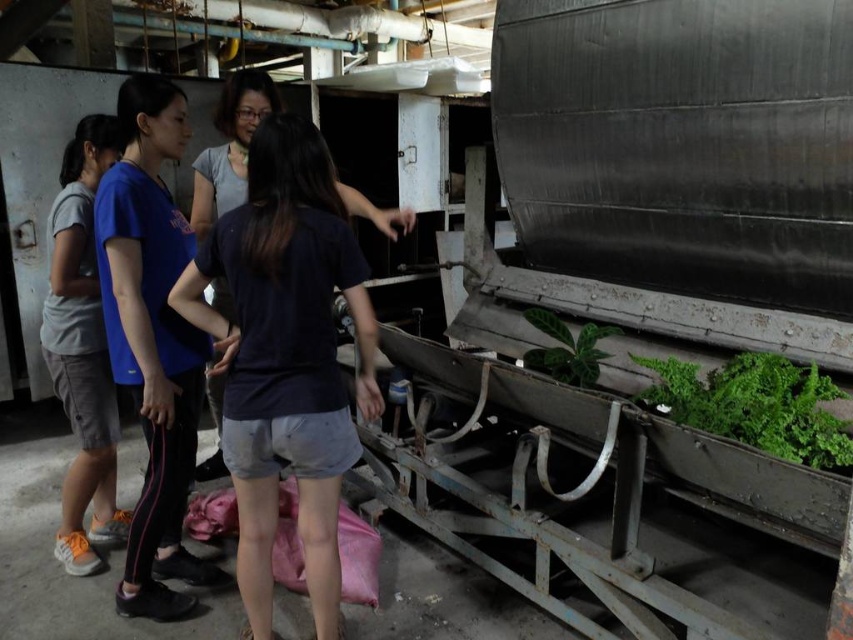
Between dark blue cotton t-shirt at center and green leafy plant at right, which one is positioned lower?

green leafy plant at right is lower down.

Is dark blue cotton t-shirt at center smaller than green leafy plant at right?

No.

What do you see at coordinates (286, 356) in the screenshot? The height and width of the screenshot is (640, 853). I see `dark blue cotton t-shirt at center` at bounding box center [286, 356].

Find the location of `dark blue cotton t-shirt at center`. dark blue cotton t-shirt at center is located at coordinates (286, 356).

Can you confirm if dark blue cotton t-shirt at center is positioned to the right of blue fabric pants at left?

Indeed, dark blue cotton t-shirt at center is positioned on the right side of blue fabric pants at left.

Does dark blue cotton t-shirt at center have a greater width compared to blue fabric pants at left?

Correct, the width of dark blue cotton t-shirt at center exceeds that of blue fabric pants at left.

Measure the distance between point [224,326] and camera.

Point [224,326] and camera are 2.02 meters apart from each other.

The image size is (853, 640). Identify the location of dark blue cotton t-shirt at center. (286, 356).

Can you confirm if green leafy plant at right is thinner than green glossy leaf at center?

No, green leafy plant at right is not thinner than green glossy leaf at center.

Does green leafy plant at right appear on the right side of green glossy leaf at center?

Correct, you'll find green leafy plant at right to the right of green glossy leaf at center.

Describe the element at coordinates (755, 404) in the screenshot. The height and width of the screenshot is (640, 853). I see `green leafy plant at right` at that location.

Identify the location of green leafy plant at right. This screenshot has width=853, height=640. (755, 404).